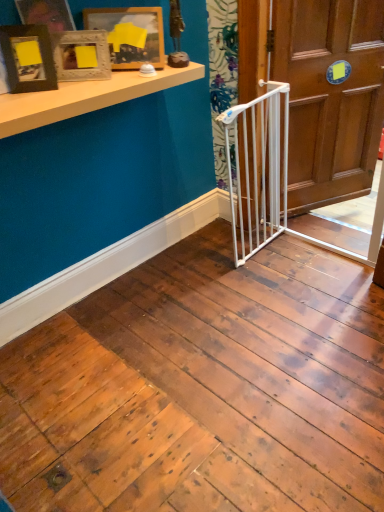
Where is `woodenobject at upper left, which appears as the 2th picture frame when viewed from the back`? The width and height of the screenshot is (384, 512). woodenobject at upper left, which appears as the 2th picture frame when viewed from the back is located at coordinates (81, 55).

What do you see at coordinates (81, 55) in the screenshot?
I see `woodenobject at upper left, which appears as the 2th picture frame when viewed from the back` at bounding box center [81, 55].

The height and width of the screenshot is (512, 384). Describe the element at coordinates (28, 58) in the screenshot. I see `matte black picture frame at upper left, the 3th picture frame in the back-to-front sequence` at that location.

Locate an element on the screen. white matte shelf at upper left is located at coordinates (86, 97).

Locate an element on the screen. This screenshot has width=384, height=512. white wooden door at center is located at coordinates (330, 96).

From the image's perspective, which is below, matte wooden picture frame at upper left, which is the first picture frame from back to front, or white wooden door at center?

From the image's view, white wooden door at center is below.

Consider the image. Is matte wooden picture frame at upper left, the third picture frame when ordered from front to back, looking in the opposite direction of white wooden door at center?

No, matte wooden picture frame at upper left, the third picture frame when ordered from front to back,'s orientation is not away from white wooden door at center.

From a real-world perspective, is matte wooden picture frame at upper left, which is the first picture frame from back to front, located higher than white wooden door at center?

Indeed, from a real-world perspective, matte wooden picture frame at upper left, which is the first picture frame from back to front, stands above white wooden door at center.

Which is behind, matte wooden picture frame at upper left, which is the first picture frame from back to front, or white wooden door at center?

white wooden door at center is behind.

Is white wooden door at center far away from matte wooden picture frame at upper left, which is the first picture frame from back to front?

Indeed, white wooden door at center is not near matte wooden picture frame at upper left, which is the first picture frame from back to front.

Can matte wooden picture frame at upper left, the third picture frame when ordered from front to back, be found inside white wooden door at center?

Definitely not — matte wooden picture frame at upper left, the third picture frame when ordered from front to back, is not inside white wooden door at center.

Is white wooden door at center wider than matte wooden picture frame at upper left, the third picture frame when ordered from front to back?

Yes.

Can you confirm if white wooden door at center is positioned to the right of matte wooden picture frame at upper left, the third picture frame when ordered from front to back?

Indeed, white wooden door at center is positioned on the right side of matte wooden picture frame at upper left, the third picture frame when ordered from front to back.

From a real-world perspective, is white wooden door at center below white matte shelf at upper left?

Indeed, from a real-world perspective, white wooden door at center is positioned beneath white matte shelf at upper left.

Considering the positions of objects white wooden door at center and white matte shelf at upper left in the image provided, who is more to the left, white wooden door at center or white matte shelf at upper left?

From the viewer's perspective, white matte shelf at upper left appears more on the left side.

How many degrees apart are the facing directions of white wooden door at center and white matte shelf at upper left?

There is a 22.4-degree angle between the facing directions of white wooden door at center and white matte shelf at upper left.

Does point (323, 64) come behind point (172, 87)?

Yes, it is behind point (172, 87).

Considering the relative positions of white wooden door at center and matte black picture frame at upper left, the first picture frame in the front-to-back sequence, in the image provided, is white wooden door at center to the left of matte black picture frame at upper left, the first picture frame in the front-to-back sequence, from the viewer's perspective?

In fact, white wooden door at center is to the right of matte black picture frame at upper left, the first picture frame in the front-to-back sequence.

Considering the relative sizes of white wooden door at center and matte black picture frame at upper left, the 3th picture frame in the back-to-front sequence, in the image provided, is white wooden door at center shorter than matte black picture frame at upper left, the 3th picture frame in the back-to-front sequence,?

Incorrect, the height of white wooden door at center does not fall short of that of matte black picture frame at upper left, the 3th picture frame in the back-to-front sequence.

From a real-world perspective, who is located higher, white wooden door at center or matte black picture frame at upper left, the first picture frame in the front-to-back sequence?

matte black picture frame at upper left, the first picture frame in the front-to-back sequence, from a real-world perspective.

Does white wooden door at center have a larger size compared to matte black picture frame at upper left, the 3th picture frame in the back-to-front sequence?

Yes.

From the image's perspective, which one is positioned higher, white wooden door at center or white plastic gate at center?

white wooden door at center is shown above in the image.

Considering the sizes of objects white wooden door at center and white plastic gate at center in the image provided, who is thinner, white wooden door at center or white plastic gate at center?

Thinner between the two is white wooden door at center.

Is white wooden door at center facing away from white plastic gate at center?

No, white wooden door at center is not facing the opposite direction of white plastic gate at center.

Would you say white wooden door at center contains white plastic gate at center?

No, white plastic gate at center is not a part of white wooden door at center.

Where is `the 3rd picture frame behind when counting from the white matte shelf at upper left`? This screenshot has height=512, width=384. the 3rd picture frame behind when counting from the white matte shelf at upper left is located at coordinates (130, 35).

Between matte wooden picture frame at upper left, the third picture frame when ordered from front to back, and white matte shelf at upper left, which one has smaller width?

With smaller width is matte wooden picture frame at upper left, the third picture frame when ordered from front to back.

What's the angular difference between matte wooden picture frame at upper left, the third picture frame when ordered from front to back, and white matte shelf at upper left's facing directions?

There is a 40-degree angle between the facing directions of matte wooden picture frame at upper left, the third picture frame when ordered from front to back, and white matte shelf at upper left.

From the image's perspective, is matte wooden picture frame at upper left, which is the first picture frame from back to front, under white matte shelf at upper left?

No, from the image's perspective, matte wooden picture frame at upper left, which is the first picture frame from back to front, is not beneath white matte shelf at upper left.

Relative to white plastic gate at center, is woodenobject at upper left, which appears as the 2th picture frame when viewed from the back, in front or behind?

Clearly, woodenobject at upper left, which appears as the 2th picture frame when viewed from the back, is behind white plastic gate at center.

Considering the positions of objects woodenobject at upper left, placed as the 2th picture frame when sorted from front to back, and white plastic gate at center in the image provided, who is more to the left, woodenobject at upper left, placed as the 2th picture frame when sorted from front to back, or white plastic gate at center?

From the viewer's perspective, woodenobject at upper left, placed as the 2th picture frame when sorted from front to back, appears more on the left side.

Is woodenobject at upper left, which appears as the 2th picture frame when viewed from the back, oriented towards white plastic gate at center?

No, woodenobject at upper left, which appears as the 2th picture frame when viewed from the back, is not turned towards white plastic gate at center.

Considering the relative sizes of woodenobject at upper left, placed as the 2th picture frame when sorted from front to back, and white plastic gate at center in the image provided, is woodenobject at upper left, placed as the 2th picture frame when sorted from front to back, bigger than white plastic gate at center?

No.

Locate an element on the screen. Image resolution: width=384 pixels, height=512 pixels. door on the right of matte wooden picture frame at upper left, the third picture frame when ordered from front to back is located at coordinates (330, 96).

This screenshot has height=512, width=384. I want to click on door below the matte wooden picture frame at upper left, which is the first picture frame from back to front (from the image's perspective), so click(x=330, y=96).

Which object lies nearer to the anchor point woodenobject at upper left, which appears as the 2th picture frame when viewed from the back, matte wooden picture frame at upper left, which is the first picture frame from back to front, or white matte shelf at upper left?

white matte shelf at upper left is positioned closer to the anchor woodenobject at upper left, which appears as the 2th picture frame when viewed from the back.

Considering their positions, is white plastic gate at center positioned further to matte wooden picture frame at upper left, the third picture frame when ordered from front to back, than white wooden door at center?

white wooden door at center.

Considering their positions, is white matte shelf at upper left positioned closer to woodenobject at upper left, placed as the 2th picture frame when sorted from front to back, than white wooden door at center?

white matte shelf at upper left.

Estimate the real-world distances between objects in this image. Which object is closer to white matte shelf at upper left, matte wooden picture frame at upper left, the third picture frame when ordered from front to back, or white plastic gate at center?

matte wooden picture frame at upper left, the third picture frame when ordered from front to back.

Considering their positions, is white wooden door at center positioned closer to white plastic gate at center than matte wooden picture frame at upper left, which is the first picture frame from back to front?

white wooden door at center lies closer to white plastic gate at center than the other object.

Based on their spatial positions, is woodenobject at upper left, which appears as the 2th picture frame when viewed from the back, or matte wooden picture frame at upper left, which is the first picture frame from back to front, further from white plastic gate at center?

The object further to white plastic gate at center is woodenobject at upper left, which appears as the 2th picture frame when viewed from the back.

Estimate the real-world distances between objects in this image. Which object is closer to white matte shelf at upper left, white plastic gate at center or white wooden door at center?

The object closer to white matte shelf at upper left is white plastic gate at center.

Which object lies further to the anchor point matte black picture frame at upper left, the first picture frame in the front-to-back sequence, white plastic gate at center or white wooden door at center?

Among the two, white wooden door at center is located further to matte black picture frame at upper left, the first picture frame in the front-to-back sequence.

Locate an element on the screen. picture frame located between matte black picture frame at upper left, the 3th picture frame in the back-to-front sequence, and matte wooden picture frame at upper left, the third picture frame when ordered from front to back, in the left-right direction is located at coordinates (81, 55).

At what (x,y) coordinates should I click in order to perform the action: click on picture frame located between white matte shelf at upper left and white plastic gate at center in the left-right direction. Please return your answer as a coordinate pair (x, y). This screenshot has height=512, width=384. Looking at the image, I should click on (130, 35).

Where is `rail between matte black picture frame at upper left, the 3th picture frame in the back-to-front sequence, and white wooden door at center`? This screenshot has height=512, width=384. rail between matte black picture frame at upper left, the 3th picture frame in the back-to-front sequence, and white wooden door at center is located at coordinates (271, 177).

Image resolution: width=384 pixels, height=512 pixels. What are the coordinates of `window sill located between woodenobject at upper left, placed as the 2th picture frame when sorted from front to back, and white wooden door at center in the left-right direction` in the screenshot? It's located at (86, 97).